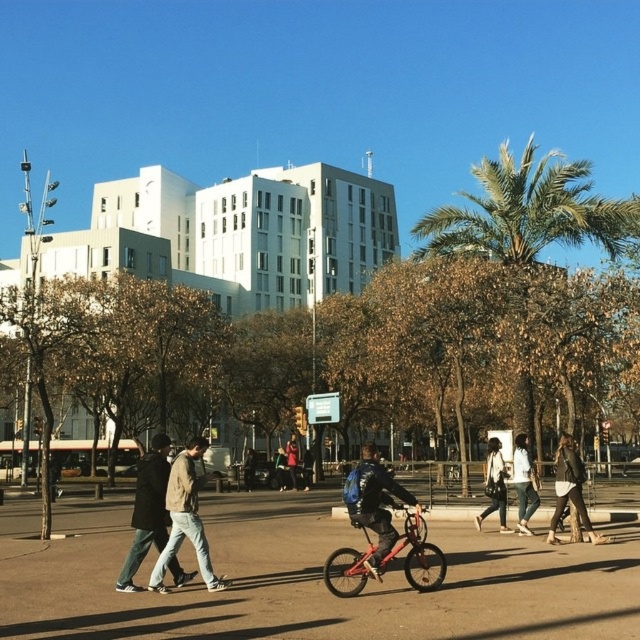
Question: Among these points, which one is farthest from the camera?

Choices:
 (A) (548, 196)
 (B) (490, 444)

Answer: (A)

Question: Which point is farther to the camera?

Choices:
 (A) (388, 520)
 (B) (248, 452)

Answer: (B)

Question: Does matte black jacket at center have a lesser width compared to leather jacket at lower right?

Choices:
 (A) yes
 (B) no

Answer: (A)

Question: Can you confirm if denim jacket at center is positioned to the right of dark blue jacket at center?

Choices:
 (A) yes
 (B) no

Answer: (A)

Question: Does dark blue backpack at center appear on the right side of dark blue jacket at center?

Choices:
 (A) no
 (B) yes

Answer: (B)

Question: Which of the following is the closest to the observer?

Choices:
 (A) metallic red bicycle at center
 (B) denim jacket at center
 (C) dark blue backpack at center
 (D) leather jacket at lower right

Answer: (A)